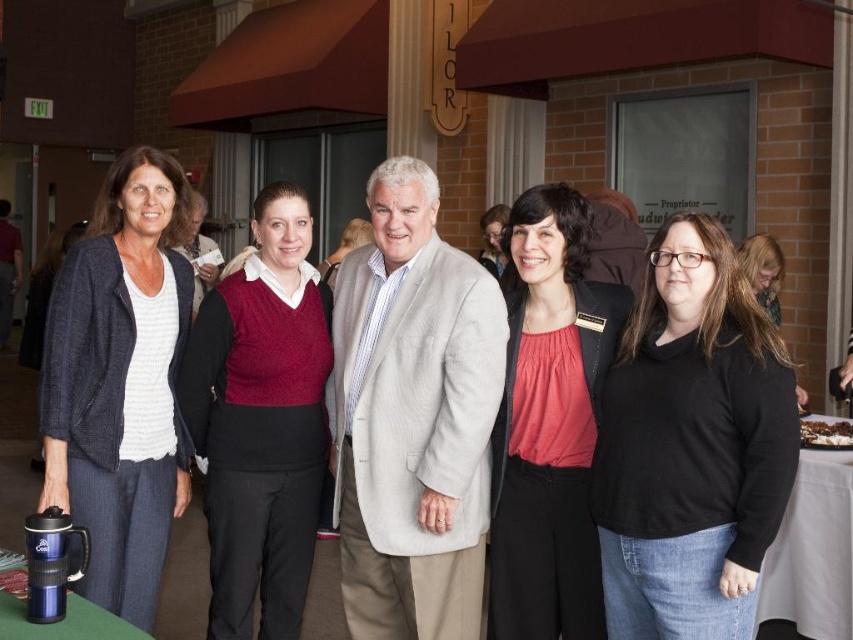
You are a photographer trying to capture a group photo of the black matte sweater at center and the white cloth table at lower right. Since you want to ensure both are in focus, you need to know which object is taller. Can you tell me which one is taller?

The black matte sweater at center is taller than the white cloth table at lower right.

You are organizing a photo shoot and need to ensure that the black matte sweater at center and the white cloth table at lower right are both visible in the frame. Based on their sizes, which object might require more space in the camera frame?

The black matte sweater at center might require more space in the camera frame since it might be wider than the white cloth table at lower right.